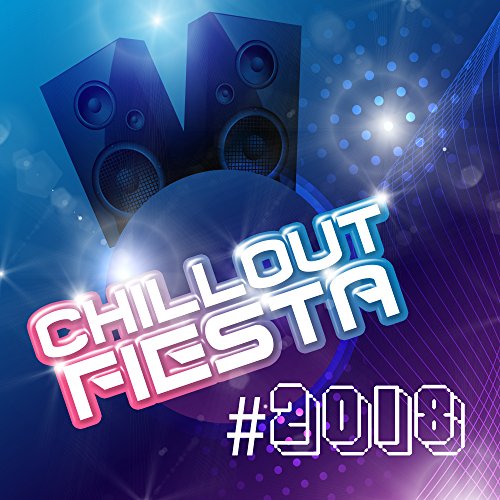
Where is `lights shining`? This screenshot has height=500, width=500. lights shining is located at coordinates (159, 20), (392, 125), (119, 271), (80, 300), (61, 367), (2, 273), (383, 200).